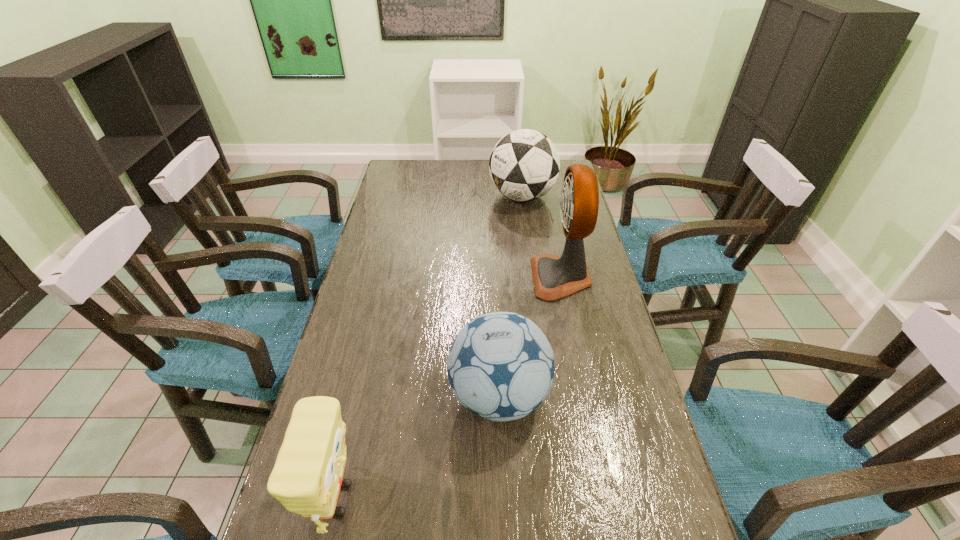
Where is `free region at the far left corner`? The height and width of the screenshot is (540, 960). free region at the far left corner is located at coordinates (389, 187).

Where is `vacant area between the farther soccer ball and the second nearest object`? The image size is (960, 540). vacant area between the farther soccer ball and the second nearest object is located at coordinates (511, 296).

The width and height of the screenshot is (960, 540). Find the location of `blank region between the farthest object and the tallest object`. blank region between the farthest object and the tallest object is located at coordinates (541, 237).

Select which object appears as the closest to the sponge. Please provide its 2D coordinates. Your answer should be formatted as a tuple, i.e. [(x, y)], where the tuple contains the x and y coordinates of a point satisfying the conditions above.

[(500, 366)]

Point out which object is positioned as the second nearest to the nearer soccer ball. Please provide its 2D coordinates. Your answer should be formatted as a tuple, i.e. [(x, y)], where the tuple contains the x and y coordinates of a point satisfying the conditions above.

[(554, 277)]